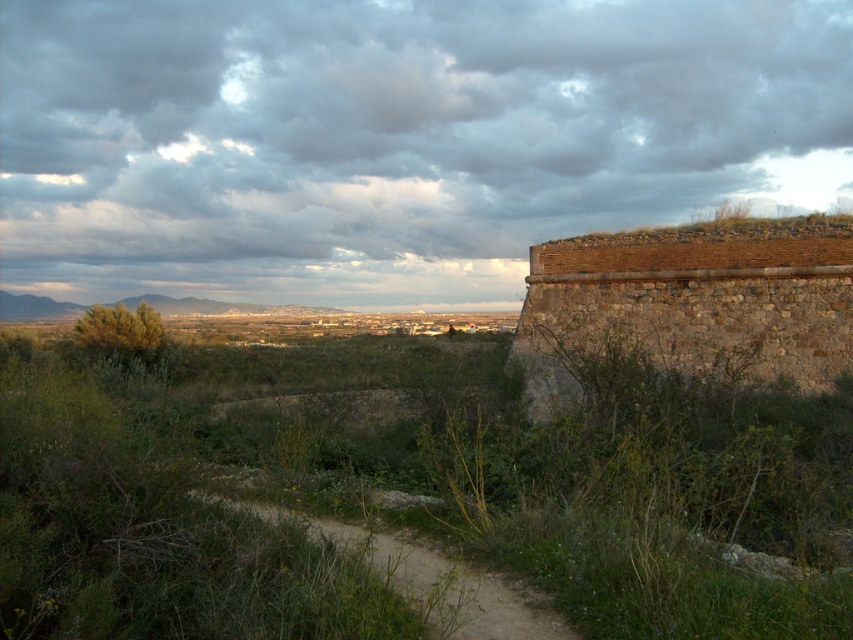
Question: Can you confirm if dark gray cloud at upper center is smaller than dirt path at center?

Choices:
 (A) yes
 (B) no

Answer: (B)

Question: Is dark gray cloud at upper center wider than dirt path at center?

Choices:
 (A) no
 (B) yes

Answer: (B)

Question: Among these points, which one is nearest to the camera?

Choices:
 (A) (117, 234)
 (B) (688, 257)

Answer: (B)

Question: Which of the following is the closest to the observer?

Choices:
 (A) dirt path at center
 (B) dark gray cloud at upper center

Answer: (A)

Question: Is dark gray cloud at upper center positioned before brown stone wall at right?

Choices:
 (A) yes
 (B) no

Answer: (B)

Question: Which point is closer to the camera?

Choices:
 (A) (737, 33)
 (B) (805, 276)
 (C) (422, 570)

Answer: (C)